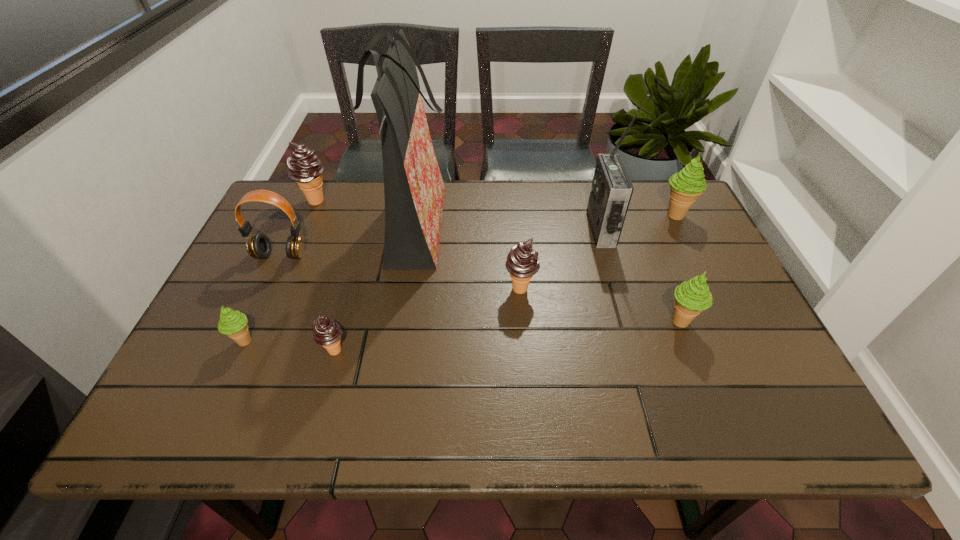
You are a GUI agent. You are given a task and a screenshot of the screen. Output one action in this format:
    pyautogui.click(x=<x>, y=<y>)
    Task: Click on the vacant space located 0.290m on the front of the leftmost chocolate icecream
    This screenshot has width=960, height=540.
    Given the screenshot: What is the action you would take?
    pyautogui.click(x=281, y=280)

Where is `free location located on the left of the rightmost icecream`? free location located on the left of the rightmost icecream is located at coordinates (544, 215).

Locate an element on the screen. vacant region located on the ear cups of the headset is located at coordinates (253, 316).

The width and height of the screenshot is (960, 540). I want to click on free space located 0.360m on the right of the second nearest chocolate icecream, so click(x=680, y=289).

Identify the location of free region located on the back of the eighth object from left to right. click(x=651, y=248).

Where is `vacant position located 0.080m on the back of the smallest green icecream`? The image size is (960, 540). vacant position located 0.080m on the back of the smallest green icecream is located at coordinates (261, 305).

Identify the location of free space located on the front of the second chocolate icecream from left to right. The height and width of the screenshot is (540, 960). (323, 395).

You are a GUI agent. You are given a task and a screenshot of the screen. Output one action in this format:
    pyautogui.click(x=<x>, y=<y>)
    Task: Click on the shopping bag at the far edge
    
    Given the screenshot: What is the action you would take?
    pyautogui.click(x=413, y=186)

Where is `radio receiver positioned at the far edge`? This screenshot has width=960, height=540. radio receiver positioned at the far edge is located at coordinates pyautogui.click(x=611, y=192).

Where is `headset that is positioned at the left edge`? Image resolution: width=960 pixels, height=540 pixels. headset that is positioned at the left edge is located at coordinates (258, 245).